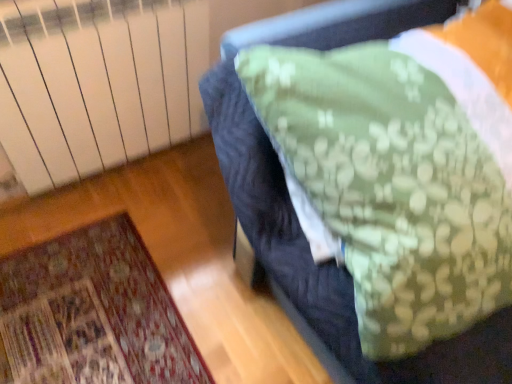
Where is `green fabric pillow at upper right`? green fabric pillow at upper right is located at coordinates (250, 168).

Image resolution: width=512 pixels, height=384 pixels. What do you see at coordinates (250, 168) in the screenshot? I see `green fabric pillow at upper right` at bounding box center [250, 168].

Locate an element on the screen. The width and height of the screenshot is (512, 384). green fabric pillow at upper right is located at coordinates (250, 168).